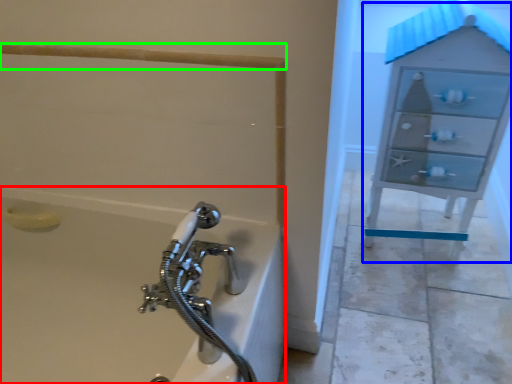
Question: Estimate the real-world distances between objects in this image. Which object is closer to bathtub (highlighted by a red box), file cabinet (highlighted by a blue box) or rail (highlighted by a green box)?

Choices:
 (A) file cabinet
 (B) rail

Answer: (B)